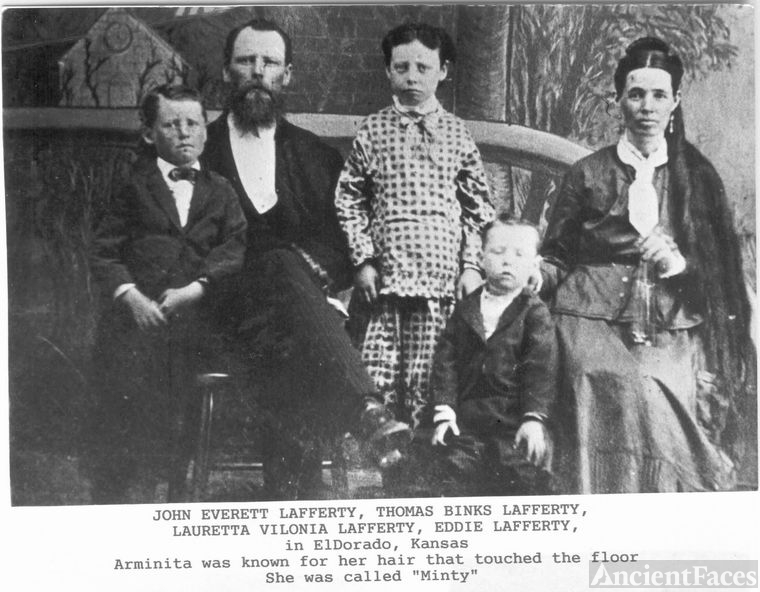
The image size is (760, 592). I want to click on background bar, so click(19, 114), click(96, 121), click(340, 125), click(510, 137), click(568, 150).